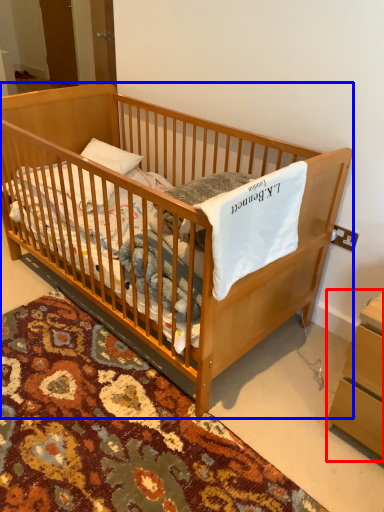
Question: Which object is closer to the camera taking this photo, changing table (highlighted by a red box) or infant bed (highlighted by a blue box)?

Choices:
 (A) changing table
 (B) infant bed

Answer: (B)